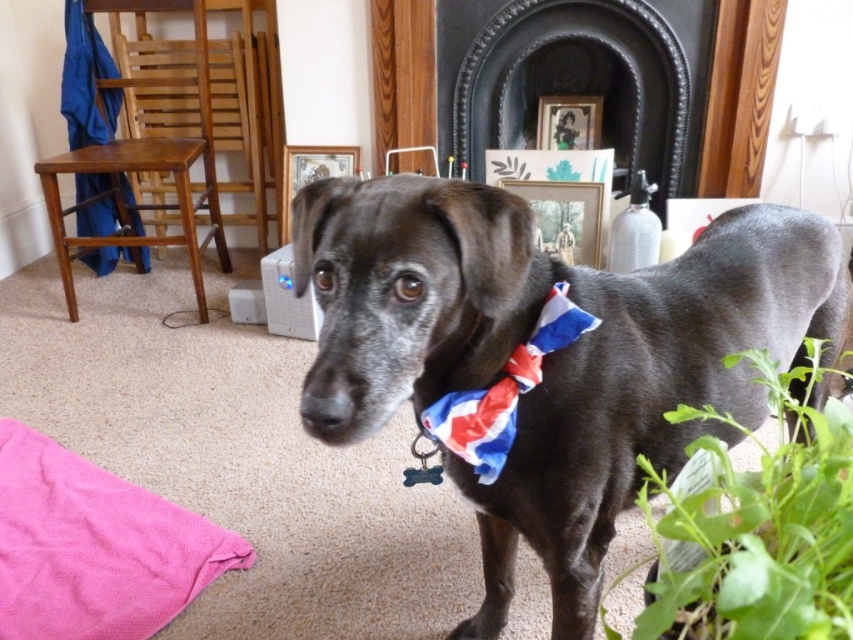
You are a guest in this living room and want to place a new small statue on a shelf that is exactly the same height as the tallest object between the green leafy plant at lower right and the union jack fabric bow tie at center. Which object should you use as a reference for the statue height?

The green leafy plant at lower right is taller than the union jack fabric bow tie at center, so you should use the green leafy plant at lower right as the reference for the statue height.

You are a guest in this living room and want to place a small vase on the table between the green leafy plant at lower right and the union jack fabric bow tie at center. Is the table between them wide enough to hold both the plant and the bow tie?

The green leafy plant at lower right is below the union jack fabric bow tie at center, so they are not on the same table. Therefore, the table between them may not exist or is not wide enough to hold both items.